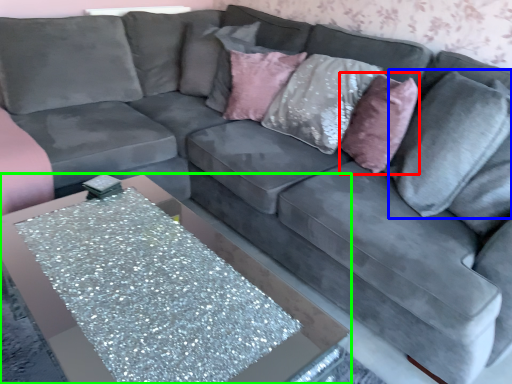
Question: Which is nearer to the throw pillow (highlighted by a red box)? pillow (highlighted by a blue box) or table (highlighted by a green box).

Choices:
 (A) pillow
 (B) table

Answer: (A)